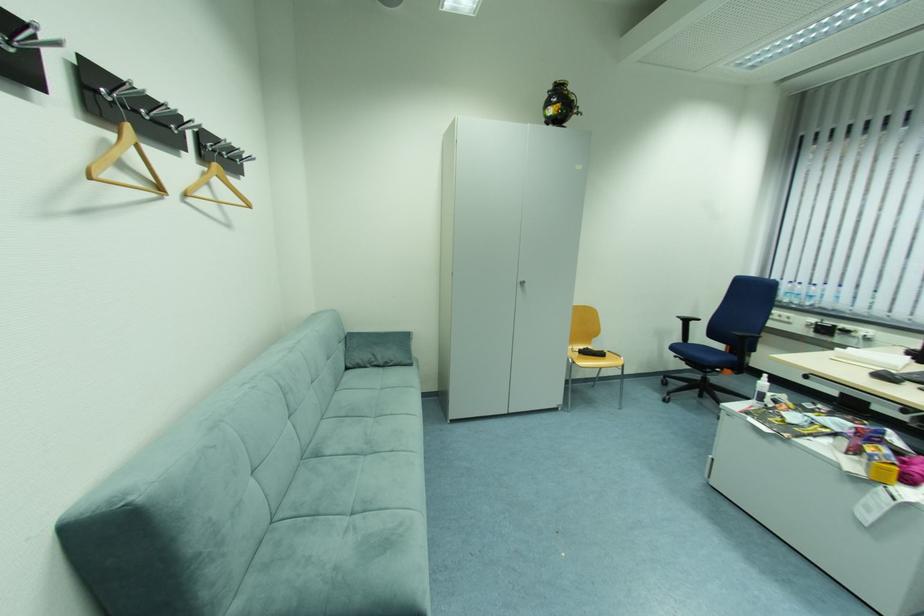
The width and height of the screenshot is (924, 616). I want to click on chair armrest, so click(687, 326).